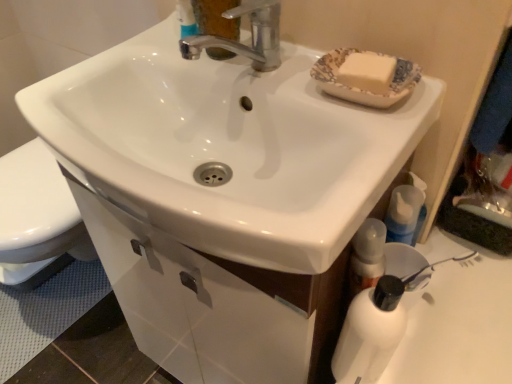
Question: From the image's perspective, is blue translucent bottle at lower right above white glossy sink at center?

Choices:
 (A) no
 (B) yes

Answer: (A)

Question: From a real-world perspective, is blue translucent bottle at lower right positioned over white glossy sink at center based on gravity?

Choices:
 (A) yes
 (B) no

Answer: (B)

Question: Does blue translucent bottle at lower right appear on the left side of white glossy sink at center?

Choices:
 (A) no
 (B) yes

Answer: (A)

Question: Does blue translucent bottle at lower right have a lesser height compared to white glossy sink at center?

Choices:
 (A) yes
 (B) no

Answer: (A)

Question: From a real-world perspective, is blue translucent bottle at lower right physically below white glossy sink at center?

Choices:
 (A) yes
 (B) no

Answer: (A)

Question: Does blue translucent bottle at lower right have a greater height compared to white glossy sink at center?

Choices:
 (A) yes
 (B) no

Answer: (B)

Question: Is white glossy sink at center in contact with blue translucent bottle at lower right?

Choices:
 (A) yes
 (B) no

Answer: (B)

Question: Is blue translucent bottle at lower right at the back of white glossy sink at center?

Choices:
 (A) yes
 (B) no

Answer: (B)

Question: From the image's perspective, is white glossy sink at center below blue translucent bottle at lower right?

Choices:
 (A) no
 (B) yes

Answer: (A)

Question: From the image's perspective, would you say white glossy sink at center is positioned over blue translucent bottle at lower right?

Choices:
 (A) yes
 (B) no

Answer: (A)

Question: Is white glossy sink at center at the right side of blue translucent bottle at lower right?

Choices:
 (A) yes
 (B) no

Answer: (B)

Question: Does white glossy sink at center have a lesser width compared to blue translucent bottle at lower right?

Choices:
 (A) yes
 (B) no

Answer: (B)

Question: From a real-world perspective, is white glossy drawer at lower center located higher than white matte bottle at lower right?

Choices:
 (A) no
 (B) yes

Answer: (A)